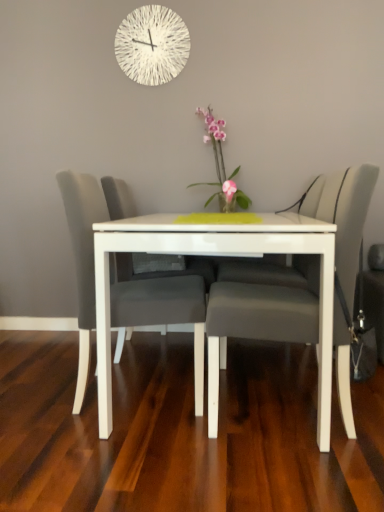
Question: Can we say matte gray chair at center, positioned as the 2th chair in right-to-left order, lies outside pink glossy vase at center?

Choices:
 (A) no
 (B) yes

Answer: (B)

Question: Is matte gray chair at center, the first chair viewed from the left, turned away from pink glossy vase at center?

Choices:
 (A) no
 (B) yes

Answer: (A)

Question: Does matte gray chair at center, the first chair viewed from the left, have a smaller size compared to pink glossy vase at center?

Choices:
 (A) yes
 (B) no

Answer: (B)

Question: Considering the relative sizes of matte gray chair at center, the first chair viewed from the left, and pink glossy vase at center in the image provided, is matte gray chair at center, the first chair viewed from the left, shorter than pink glossy vase at center?

Choices:
 (A) no
 (B) yes

Answer: (A)

Question: Is matte gray chair at center, positioned as the 2th chair in right-to-left order, to the right of pink glossy vase at center from the viewer's perspective?

Choices:
 (A) no
 (B) yes

Answer: (A)

Question: Is white glossy table at center next to white textured clock at upper center?

Choices:
 (A) yes
 (B) no

Answer: (B)

Question: From a real-world perspective, is white glossy table at center on top of white textured clock at upper center?

Choices:
 (A) yes
 (B) no

Answer: (B)

Question: Is white glossy table at center closer to the viewer compared to white textured clock at upper center?

Choices:
 (A) yes
 (B) no

Answer: (A)

Question: Can you confirm if white glossy table at center is positioned to the left of white textured clock at upper center?

Choices:
 (A) no
 (B) yes

Answer: (A)

Question: Is white glossy table at center positioned with its back to white textured clock at upper center?

Choices:
 (A) no
 (B) yes

Answer: (A)

Question: From the image's perspective, is white glossy table at center on white textured clock at upper center?

Choices:
 (A) no
 (B) yes

Answer: (A)

Question: From the image's perspective, does matte gray chair at center, the first chair viewed from the right, appear lower than pink glossy vase at center?

Choices:
 (A) no
 (B) yes

Answer: (B)